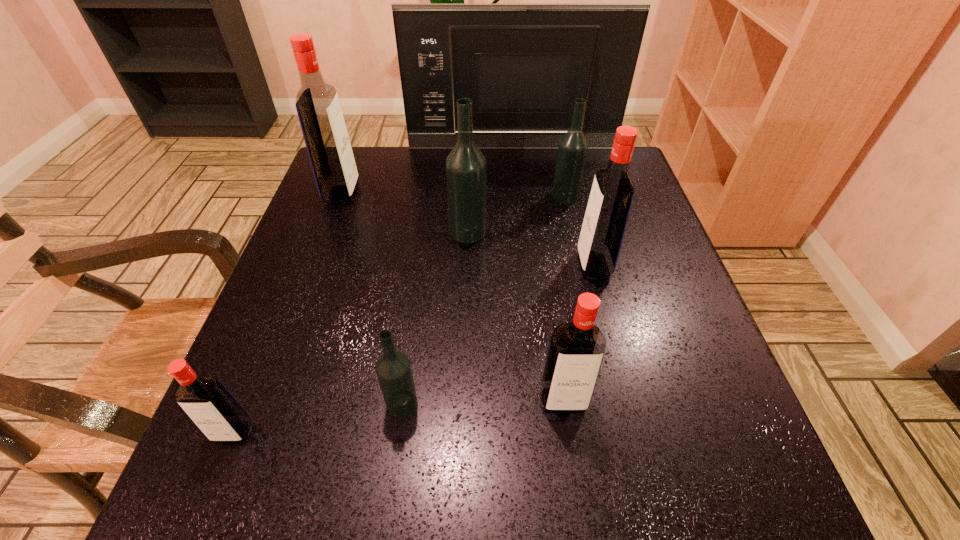
In order to click on the second smallest red vodka in this screenshot , I will do `click(576, 349)`.

Identify the location of the third vodka from right to left. (576, 349).

Where is `the nearest black vodka`? The image size is (960, 540). the nearest black vodka is located at coordinates (393, 368).

Identify the location of the third vodka from left to right. (393, 368).

Locate an element on the screen. The image size is (960, 540). the smallest red vodka is located at coordinates (208, 403).

This screenshot has width=960, height=540. I want to click on the nearest object, so click(x=208, y=403).

This screenshot has width=960, height=540. Find the location of `free region located 0.240m on the front panel of the dark microwave oven`. free region located 0.240m on the front panel of the dark microwave oven is located at coordinates (517, 201).

Identify the location of vacant space located 0.160m on the front and back of the farthest red vodka. (422, 194).

I want to click on free space located 0.290m on the left of the second farthest black vodka, so click(x=320, y=232).

The image size is (960, 540). In order to click on free location located 0.350m on the front and back of the second biggest red vodka in this screenshot , I will do `click(409, 265)`.